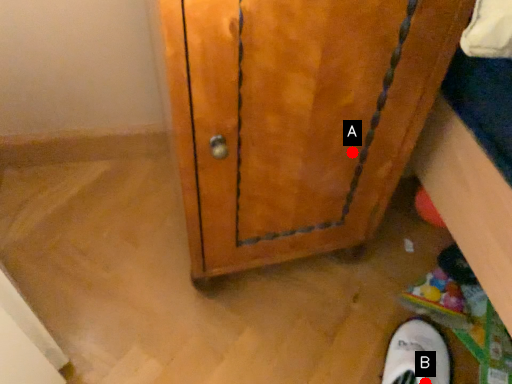
Question: Two points are circled on the image, labeled by A and B beside each circle. Which point is further to the camera?

Choices:
 (A) A is further
 (B) B is further

Answer: (B)